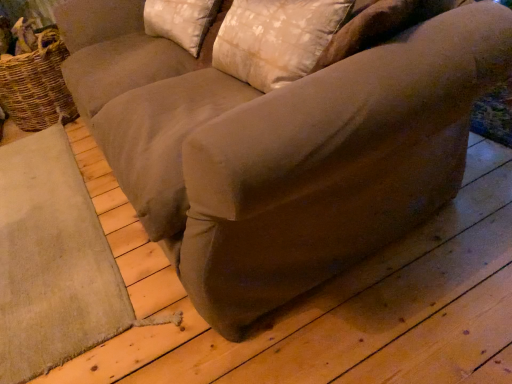
Question: Visually, is satin beige pillow at upper center, the 1th pillow viewed from the front, positioned to the left or to the right of beige fabric pillow at upper center, marked as the first pillow in a back-to-front arrangement?

Choices:
 (A) right
 (B) left

Answer: (A)

Question: Is satin beige pillow at upper center, arranged as the 2th pillow when viewed from the back, in front of or behind beige fabric pillow at upper center, which ranks as the 2th pillow in front-to-back order, in the image?

Choices:
 (A) behind
 (B) front

Answer: (B)

Question: Which of these objects is positioned farthest from the satin beige pillow at upper center, arranged as the 2th pillow when viewed from the back?

Choices:
 (A) woven brown basket at left
 (B) beige fabric pillow at upper center, which ranks as the 2th pillow in front-to-back order

Answer: (A)

Question: Estimate the real-world distances between objects in this image. Which object is farther from the satin beige pillow at upper center, the 1th pillow viewed from the front?

Choices:
 (A) beige fabric pillow at upper center, marked as the first pillow in a back-to-front arrangement
 (B) woven brown basket at left

Answer: (B)